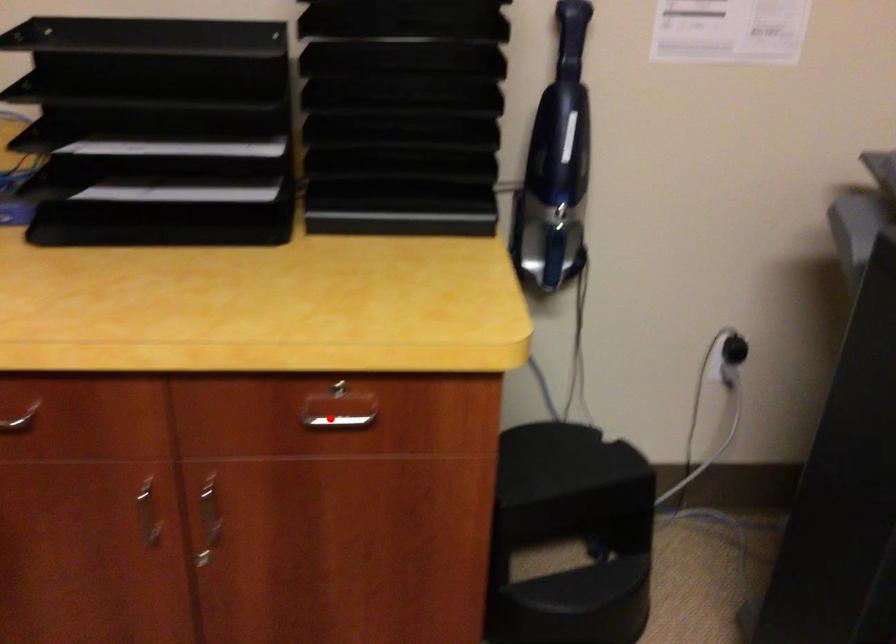
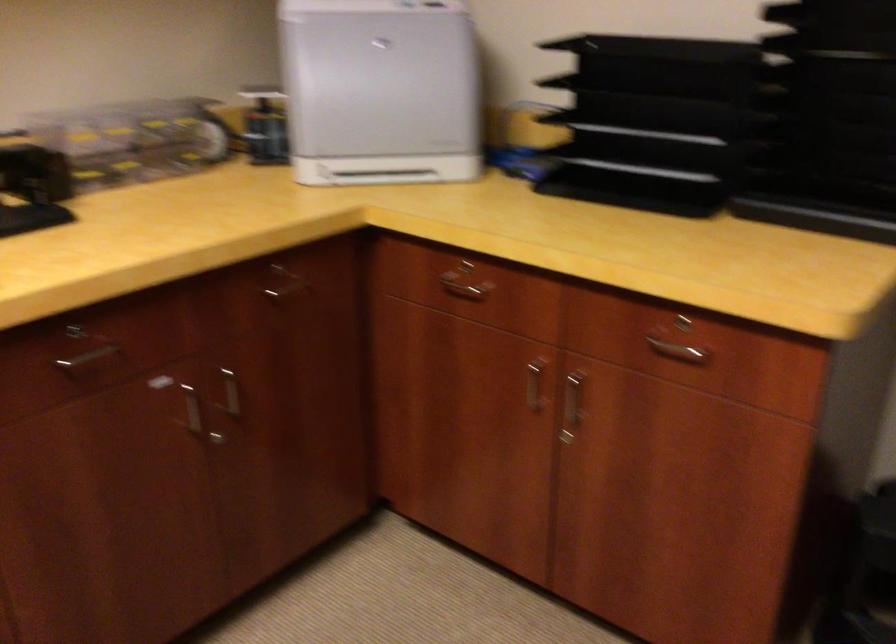
Question: I am providing you with two images of the same scene from different viewpoints. Given a red point in image1, look at the same physical point in image2. Is it:

Choices:
 (A) Closer to the viewpoint
 (B) Farther from the viewpoint

Answer: (B)